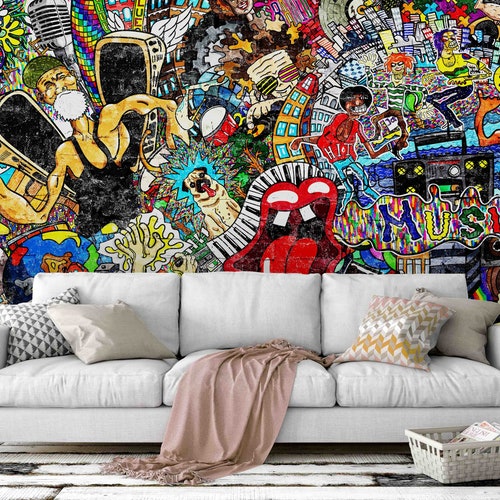
Locate an element on the screen. This screenshot has height=500, width=500. magazine is located at coordinates (483, 429), (484, 426), (493, 425).